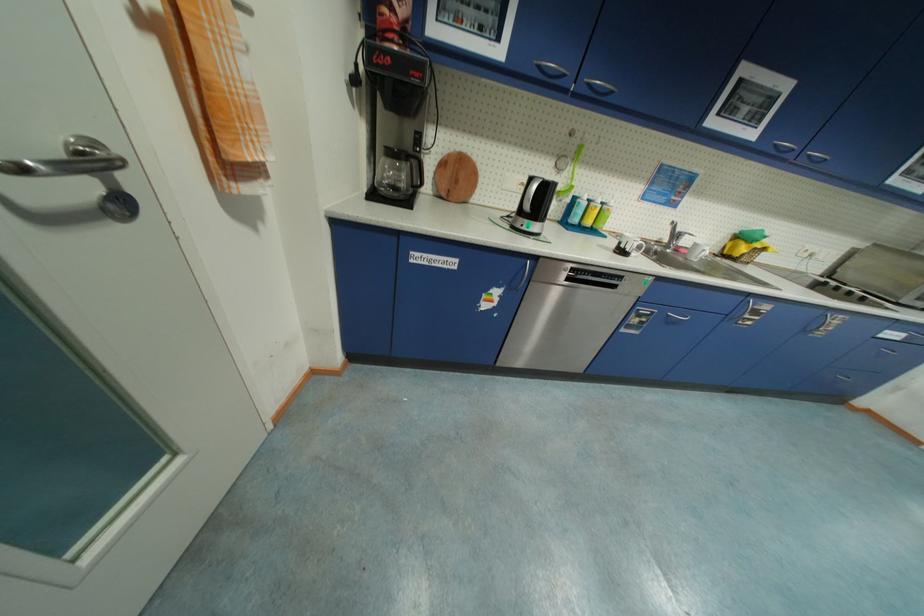
Find the location of a particular element. This screenshot has height=616, width=924. round wooden board is located at coordinates (456, 177).